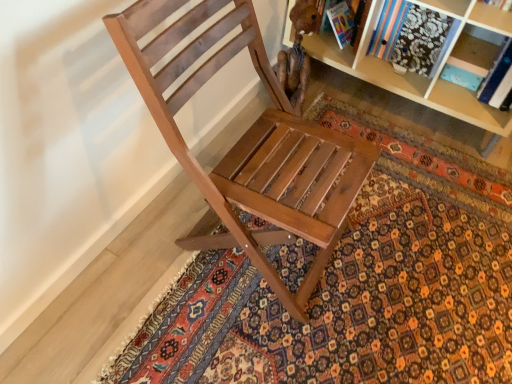
Question: Is wooden chair at center next to patterned carpet at center and touching it?

Choices:
 (A) yes
 (B) no

Answer: (B)

Question: From the image's perspective, would you say wooden chair at center is shown under patterned carpet at center?

Choices:
 (A) no
 (B) yes

Answer: (A)

Question: Is wooden chair at center positioned with its back to patterned carpet at center?

Choices:
 (A) yes
 (B) no

Answer: (B)

Question: Considering the relative positions of wooden chair at center and patterned carpet at center in the image provided, is wooden chair at center behind patterned carpet at center?

Choices:
 (A) no
 (B) yes

Answer: (A)

Question: Is wooden chair at center facing towards patterned carpet at center?

Choices:
 (A) no
 (B) yes

Answer: (B)

Question: Is wooden chair at center positioned far away from patterned carpet at center?

Choices:
 (A) no
 (B) yes

Answer: (A)

Question: Does patterned carpet at center have a greater width compared to wooden chair at center?

Choices:
 (A) yes
 (B) no

Answer: (A)

Question: Considering the relative sizes of patterned carpet at center and wooden chair at center in the image provided, is patterned carpet at center smaller than wooden chair at center?

Choices:
 (A) yes
 (B) no

Answer: (A)

Question: From a real-world perspective, is patterned carpet at center positioned over wooden chair at center based on gravity?

Choices:
 (A) no
 (B) yes

Answer: (A)

Question: Does patterned carpet at center have a lesser width compared to wooden chair at center?

Choices:
 (A) no
 (B) yes

Answer: (A)

Question: Is patterned carpet at center in front of wooden chair at center?

Choices:
 (A) no
 (B) yes

Answer: (A)

Question: Does patterned carpet at center lie behind wooden chair at center?

Choices:
 (A) no
 (B) yes

Answer: (B)

Question: From a real-world perspective, is wooden chair at center physically located above or below patterned carpet at center?

Choices:
 (A) below
 (B) above

Answer: (B)